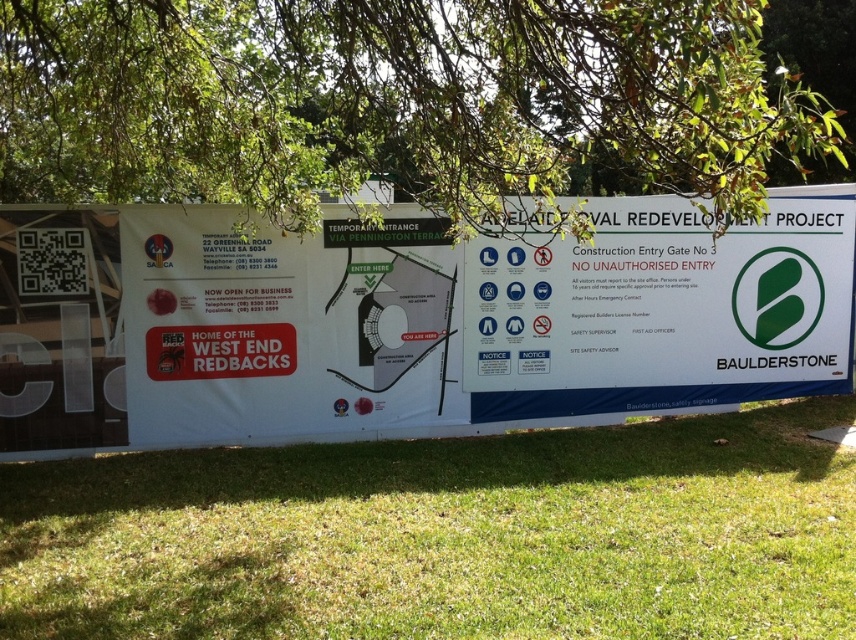
Question: Among these points, which one is nearest to the camera?

Choices:
 (A) (281, 220)
 (B) (795, 346)

Answer: (A)

Question: Observing the image, what is the correct spatial positioning of green grass at lower center in reference to green leafy tree at upper center?

Choices:
 (A) right
 (B) left

Answer: (B)

Question: Among these points, which one is farthest from the camera?

Choices:
 (A) pos(488,342)
 (B) pos(462,474)
 (C) pos(113,163)

Answer: (A)

Question: Estimate the real-world distances between objects in this image. Which object is closer to the white paper sign at center?

Choices:
 (A) green leafy tree at upper center
 (B) green grass at lower center

Answer: (B)

Question: Does green grass at lower center have a greater width compared to white paper sign at center?

Choices:
 (A) no
 (B) yes

Answer: (B)

Question: Is green grass at lower center smaller than white paper sign at center?

Choices:
 (A) no
 (B) yes

Answer: (B)